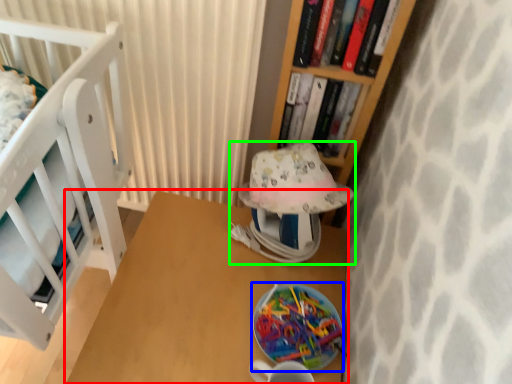
Question: Based on their relative distances, which object is nearer to table (highlighted by a red box)? Choose from plate (highlighted by a blue box) and table lamp (highlighted by a green box).

Choices:
 (A) plate
 (B) table lamp

Answer: (A)